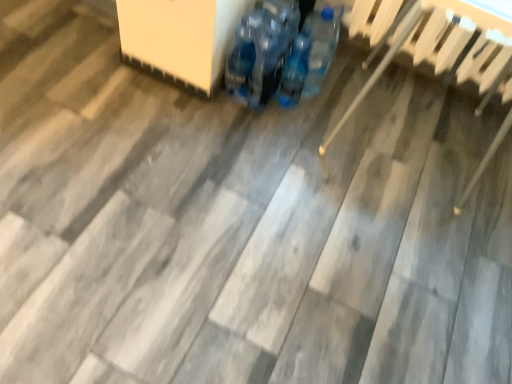
Question: Can you confirm if blue plastic bottles at center is taller than blue plastic bottles at center?

Choices:
 (A) yes
 (B) no

Answer: (B)

Question: Is blue plastic bottles at center not near blue plastic bottles at center?

Choices:
 (A) no
 (B) yes

Answer: (A)

Question: From a real-world perspective, is blue plastic bottles at center located higher than blue plastic bottles at center?

Choices:
 (A) yes
 (B) no

Answer: (B)

Question: From a real-world perspective, is blue plastic bottles at center under blue plastic bottles at center?

Choices:
 (A) yes
 (B) no

Answer: (A)

Question: Would you say blue plastic bottles at center is part of blue plastic bottles at center's contents?

Choices:
 (A) yes
 (B) no

Answer: (B)

Question: Is point (306, 54) positioned closer to the camera than point (261, 96)?

Choices:
 (A) closer
 (B) farther

Answer: (B)

Question: Do you think blue plastic bottles at center is within blue plastic bottles at center, or outside of it?

Choices:
 (A) outside
 (B) inside

Answer: (A)

Question: From a real-world perspective, relative to blue plastic bottles at center, is blue plastic bottles at center vertically above or below?

Choices:
 (A) below
 (B) above

Answer: (A)

Question: Looking at the image, does blue plastic bottles at center seem bigger or smaller compared to blue plastic bottles at center?

Choices:
 (A) small
 (B) big

Answer: (A)

Question: Considering the positions of wooden chair at right and blue plastic bottles at center in the image, is wooden chair at right wider or thinner than blue plastic bottles at center?

Choices:
 (A) wide
 (B) thin

Answer: (A)

Question: From a real-world perspective, relative to blue plastic bottles at center, is wooden chair at right vertically above or below?

Choices:
 (A) below
 (B) above

Answer: (B)

Question: From the image's perspective, is wooden chair at right above or below blue plastic bottles at center?

Choices:
 (A) above
 (B) below

Answer: (B)

Question: Is point (439, 59) positioned closer to the camera than point (303, 86)?

Choices:
 (A) closer
 (B) farther

Answer: (B)

Question: Which is correct: blue plastic bottles at center is inside wooden chair at right, or outside of it?

Choices:
 (A) inside
 (B) outside

Answer: (B)

Question: Considering the positions of point (293, 54) and point (484, 41), is point (293, 54) closer or farther from the camera than point (484, 41)?

Choices:
 (A) closer
 (B) farther

Answer: (B)